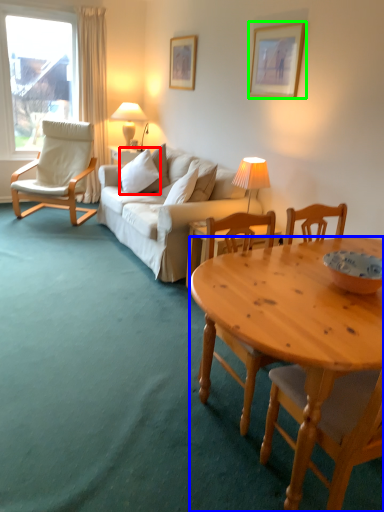
Question: Which is farther away from pillow (highlighted by a red box)? desk (highlighted by a blue box) or picture frame (highlighted by a green box)?

Choices:
 (A) desk
 (B) picture frame

Answer: (A)